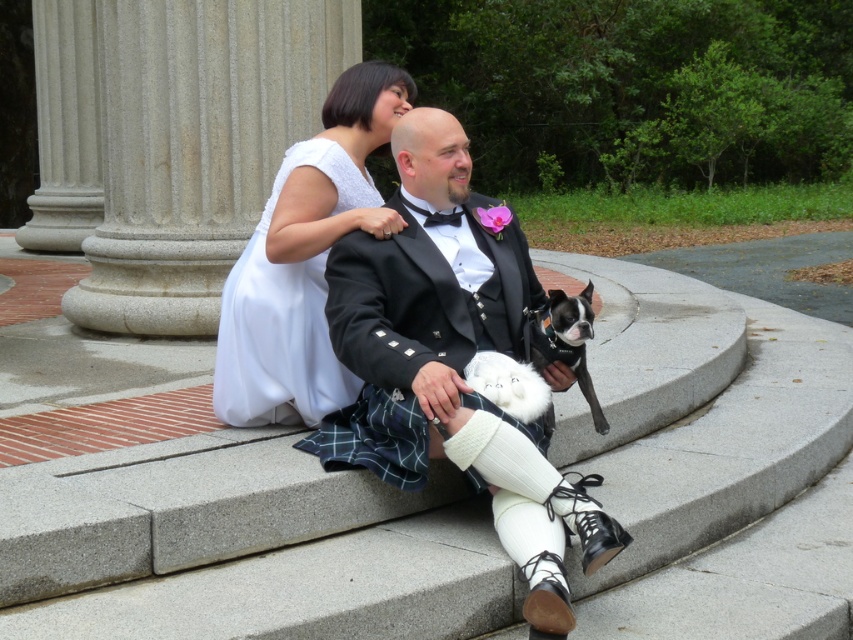
Question: Is shiny black suit at center thinner than white fluffy dog at center?

Choices:
 (A) yes
 (B) no

Answer: (B)

Question: Which is farther from the white sheer dress at center?

Choices:
 (A) shiny black suit at center
 (B) white fluffy dog at center
 (C) black glossy dog at center

Answer: (C)

Question: Observing the image, what is the correct spatial positioning of shiny black suit at center in reference to white sheer dress at center?

Choices:
 (A) below
 (B) above

Answer: (A)

Question: Can you confirm if shiny black suit at center is positioned to the left of white sheer dress at center?

Choices:
 (A) no
 (B) yes

Answer: (A)

Question: Which of the following is the farthest from the observer?

Choices:
 (A) (508, 337)
 (B) (236, 401)
 (C) (482, 355)

Answer: (B)

Question: Estimate the real-world distances between objects in this image. Which object is closer to the white sheer dress at center?

Choices:
 (A) shiny black suit at center
 (B) white fluffy dog at center

Answer: (A)